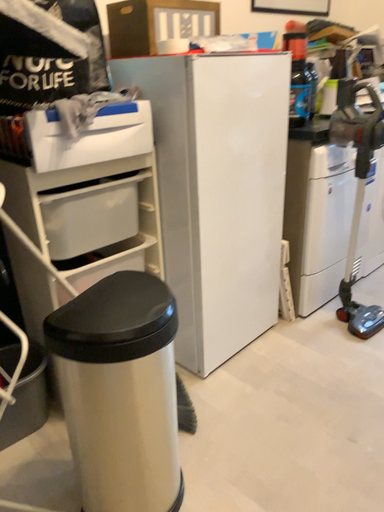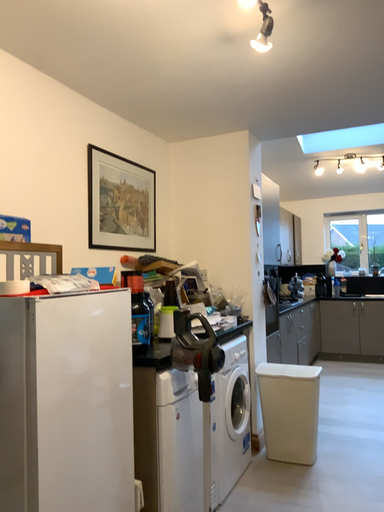
Question: Which way did the camera rotate in the video?

Choices:
 (A) rotated left
 (B) rotated right

Answer: (B)